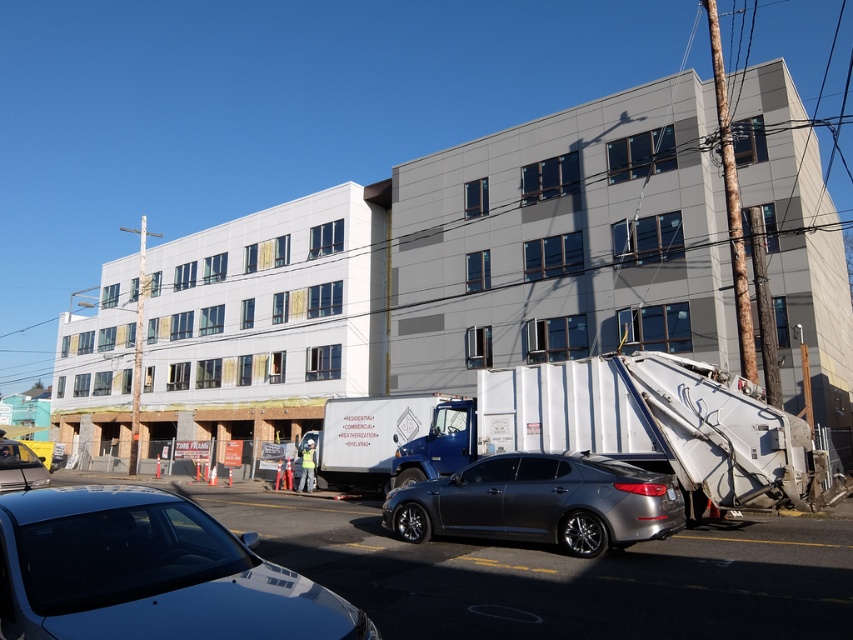
Question: Can you confirm if white metallic garbage truck at lower right is positioned to the left of shiny silver sedan at lower left?

Choices:
 (A) no
 (B) yes

Answer: (A)

Question: Among these objects, which one is nearest to the camera?

Choices:
 (A) shiny silver sedan at lower left
 (B) satin gray sedan at center

Answer: (B)

Question: Which point is closer to the camera?

Choices:
 (A) (737, 477)
 (B) (566, 515)
 (C) (167, 600)

Answer: (C)

Question: Which of the following is the farthest from the observer?

Choices:
 (A) (86, 554)
 (B) (6, 474)
 (C) (560, 460)
 (D) (733, 500)

Answer: (B)

Question: Can you confirm if satin gray sedan at center is smaller than shiny silver sedan at lower left?

Choices:
 (A) yes
 (B) no

Answer: (A)

Question: Can you confirm if shiny black sedan at lower left is positioned below white metallic garbage truck at lower right?

Choices:
 (A) yes
 (B) no

Answer: (B)